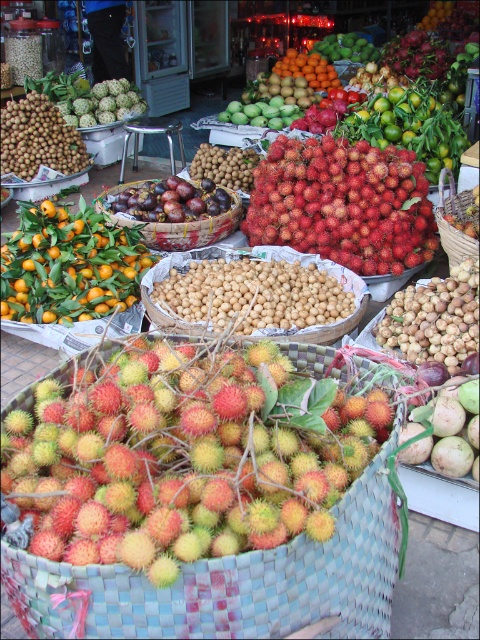
Question: Which of the following is the closest to the observer?

Choices:
 (A) (39, 476)
 (B) (440, 241)

Answer: (A)

Question: Can you confirm if red matte rambutan at center is bigger than green matte mango at center?

Choices:
 (A) no
 (B) yes

Answer: (B)

Question: Among these points, which one is farthest from the camera?

Choices:
 (A) (120, 221)
 (B) (152, 440)
 (C) (58, 156)

Answer: (C)

Question: Does smooth beige longan at center have a smaller size compared to smooth brown longan at upper left?

Choices:
 (A) no
 (B) yes

Answer: (B)

Question: Can you confirm if smooth beige longan at center is positioned to the right of smooth brown longan at upper left?

Choices:
 (A) yes
 (B) no

Answer: (A)

Question: Which point appears farthest from the camera in this image?

Choices:
 (A) (444, 291)
 (B) (203, 240)
 (C) (12, 282)

Answer: (B)